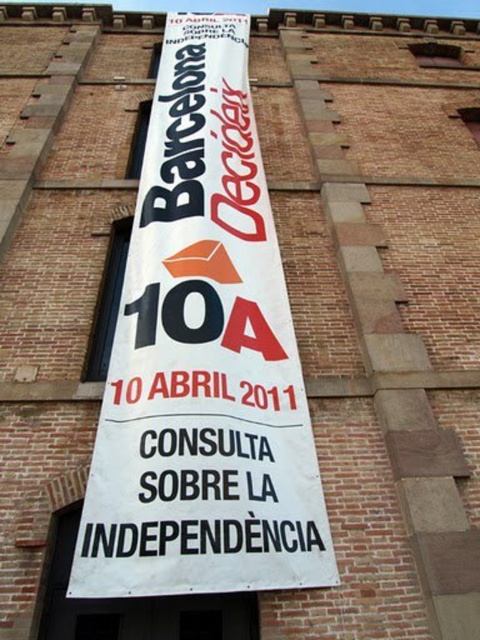
You are an event planner looking at the banner for an upcoming consultation event. The banner has two main elements. The first is the white paper banner at center, and the second is the black paper text at center. Which of these elements is taller?

The white paper banner at center has a greater height compared to the black paper text at center, so the white paper banner at center is taller.

You are a city planner reviewing a proposed banner design for a public event. The banner must adhere to city regulations that require the background to be at least twice as large as the text area. Based on the provided image, does the white paper banner at center meet the city regulation requirements compared to the black paper text at center?

The white paper banner at center is bigger than the black paper text at center, so it likely meets the city regulation requirements as the background is larger than the text area.

You are a window cleaner standing on a ladder 5 feet away from the building. You need to clean the white paper banner at center and the black paper text at center. Can you reach both with a 6 foot pole?

The white paper banner at center is 3.63 feet from black paper text at center. Since you are 5 feet away from the building, the total distance to the white paper banner at center is 5 feet plus 3.63 feet, which is 8.63 feet. A 6 foot pole is not long enough to reach either object. You need a longer pole.